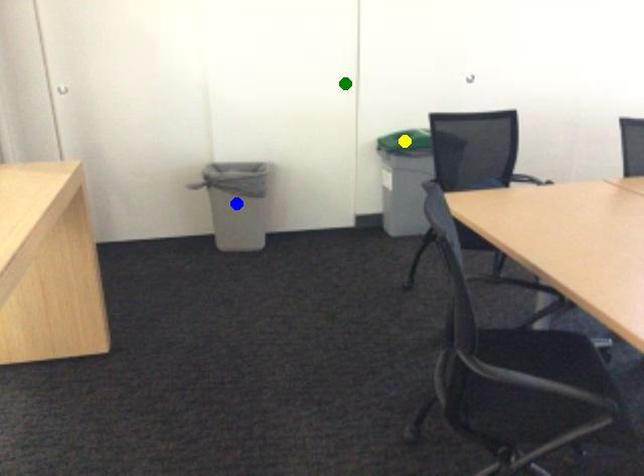
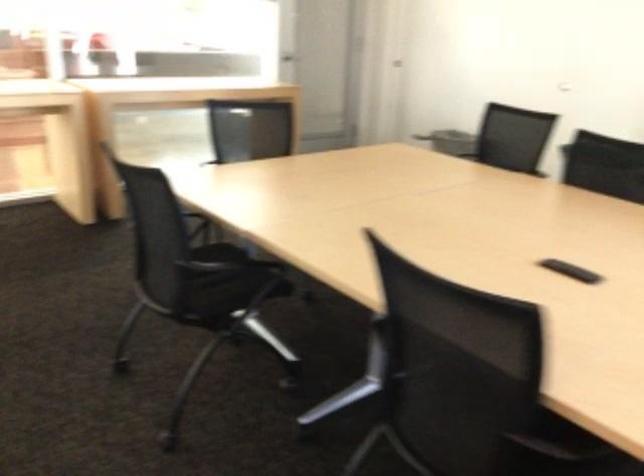
I am providing you with two images of the same scene from different viewpoints. Three points are marked in image1. Which point corresponds to a part or object that is occluded in image2?In image1, three points are marked. Which of them correspond to a part or object that is occluded in image2?Among the three points shown in image1, which one corresponds to a part or object that is no longer visible due to occlusion in image2?

yellow point, green point, blue point